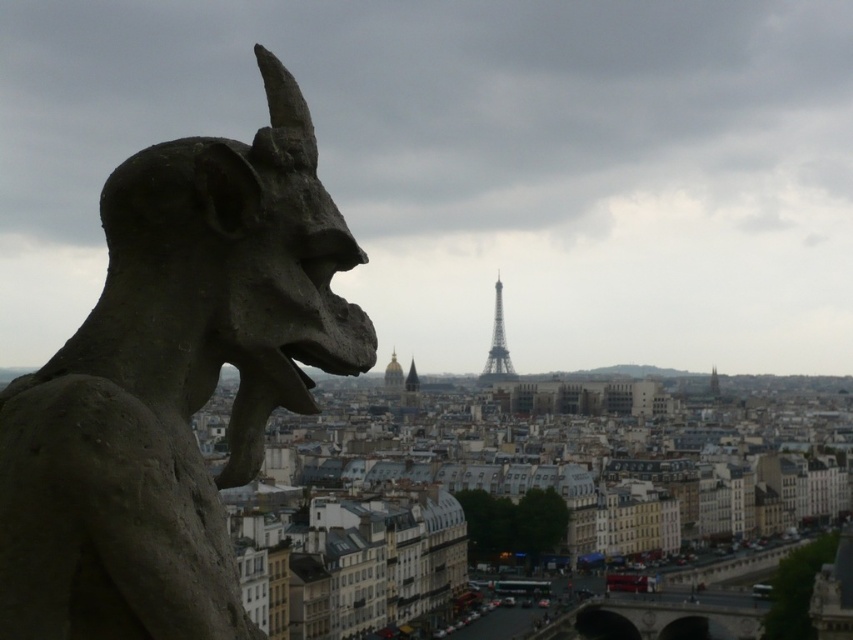
What do you see at coordinates (497, 348) in the screenshot? I see `golden metallic eiffel tower at center` at bounding box center [497, 348].

The image size is (853, 640). I want to click on golden metallic eiffel tower at center, so (x=497, y=348).

Does dark gray stone gargoyle at left have a lesser width compared to gold dome at center?

Yes, dark gray stone gargoyle at left is thinner than gold dome at center.

Which is more to the right, dark gray stone gargoyle at left or gold dome at center?

From the viewer's perspective, dark gray stone gargoyle at left appears more on the right side.

At what (x,y) coordinates should I click in order to perform the action: click on dark gray stone gargoyle at left. Please return your answer as a coordinate pair (x, y). This screenshot has height=640, width=853. Looking at the image, I should click on coord(173,384).

Can you confirm if dark gray stone gargoyle at left is positioned to the right of golden metallic eiffel tower at center?

No, dark gray stone gargoyle at left is not to the right of golden metallic eiffel tower at center.

From the picture: Can you confirm if dark gray stone gargoyle at left is smaller than golden metallic eiffel tower at center?

Yes, dark gray stone gargoyle at left is smaller than golden metallic eiffel tower at center.

Is point (244, 324) farther from camera compared to point (495, 369)?

That is False.

Locate an element on the screen. The width and height of the screenshot is (853, 640). dark gray stone gargoyle at left is located at coordinates (173, 384).